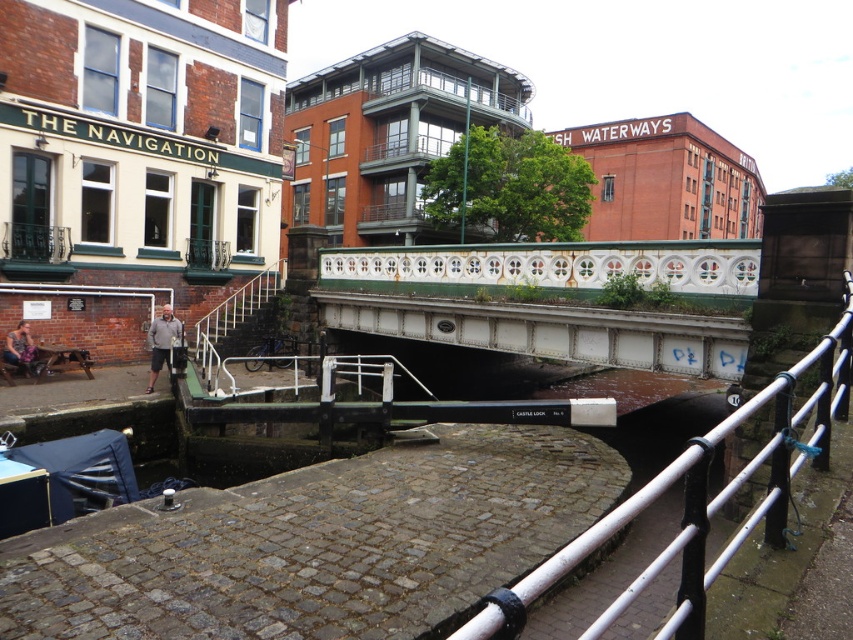
Between white painted metal bridge at center and white metal railing at center, which one appears on the right side from the viewer's perspective?

white metal railing at center is more to the right.

Identify the location of white painted metal bridge at center. (547, 298).

This screenshot has width=853, height=640. Find the location of `white painted metal bridge at center`. white painted metal bridge at center is located at coordinates (547, 298).

Does white painted metal bridge at center appear on the left side of matte black jacket at lower left?

Incorrect, white painted metal bridge at center is not on the left side of matte black jacket at lower left.

Can you confirm if white painted metal bridge at center is positioned to the right of matte black jacket at lower left?

Correct, you'll find white painted metal bridge at center to the right of matte black jacket at lower left.

Between point (366, 305) and point (24, 330), which one is positioned behind?

Positioned behind is point (366, 305).

Where is `white painted metal bridge at center`? This screenshot has height=640, width=853. white painted metal bridge at center is located at coordinates (547, 298).

Between white painted metal bridge at center and gray fabric pants at lower left, which one appears on the right side from the viewer's perspective?

From the viewer's perspective, white painted metal bridge at center appears more on the right side.

Is white painted metal bridge at center taller than gray fabric pants at lower left?

Indeed, white painted metal bridge at center has a greater height compared to gray fabric pants at lower left.

Between point (737, 278) and point (167, 305), which one is positioned in front?

Positioned in front is point (737, 278).

Locate an element on the screen. This screenshot has height=640, width=853. white painted metal bridge at center is located at coordinates (547, 298).